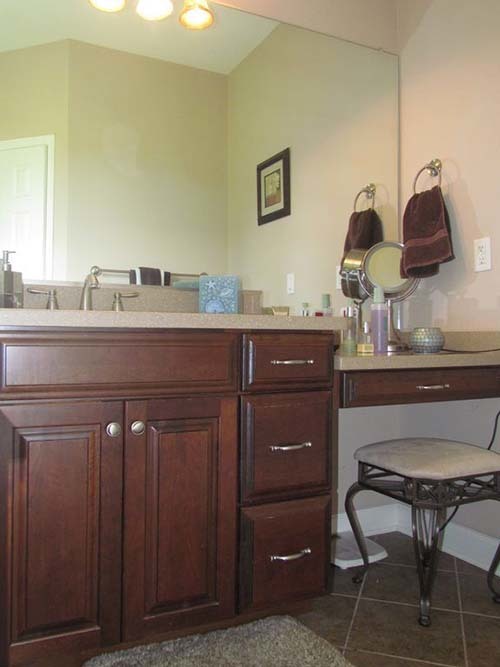
Image resolution: width=500 pixels, height=667 pixels. What are the coordinates of `painting` in the screenshot? It's located at (267, 183).